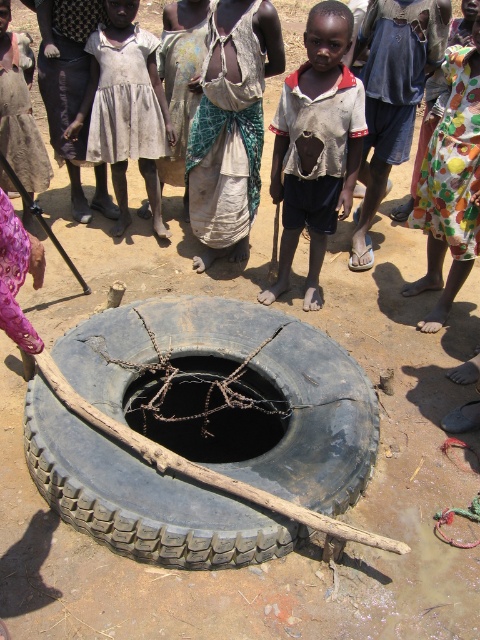
Is ripped white shirt at center positioned behind dark rubber tire at center?

That is True.

Measure the distance between point (297,186) and camera.

Point (297,186) and camera are 4.27 meters apart from each other.

In order to click on ripped white shirt at center in this screenshot , I will do `click(315, 145)`.

Who is shorter, white cotton dress at center or pink fabric at lower left?

pink fabric at lower left

Is point (106, 125) positioned before point (1, 257)?

No, (106, 125) is further to viewer.

Is point (132, 74) behind point (3, 308)?

Yes.

Locate an element on the screen. Image resolution: width=480 pixels, height=640 pixels. white cotton dress at center is located at coordinates (126, 108).

Is white fabric skirt at center to the left of pink fabric at lower left from the viewer's perspective?

No, white fabric skirt at center is not to the left of pink fabric at lower left.

Can you confirm if white fabric skirt at center is wider than pink fabric at lower left?

Yes.

Which is behind, point (274, 52) or point (43, 344)?

The point (274, 52) is more distant.

You are a GUI agent. You are given a task and a screenshot of the screen. Output one action in this format:
    pyautogui.click(x=<x>, y=<y>)
    Task: Click on the white fabric skirt at center
    This screenshot has height=640, width=480.
    Given the screenshot: What is the action you would take?
    pyautogui.click(x=230, y=125)